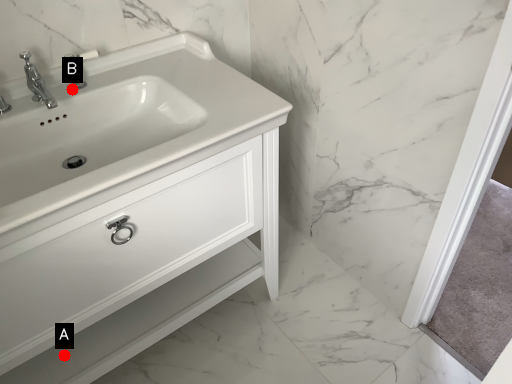
Question: Two points are circled on the image, labeled by A and B beside each circle. Which point appears closest to the camera in this image?

Choices:
 (A) A is closer
 (B) B is closer

Answer: (B)